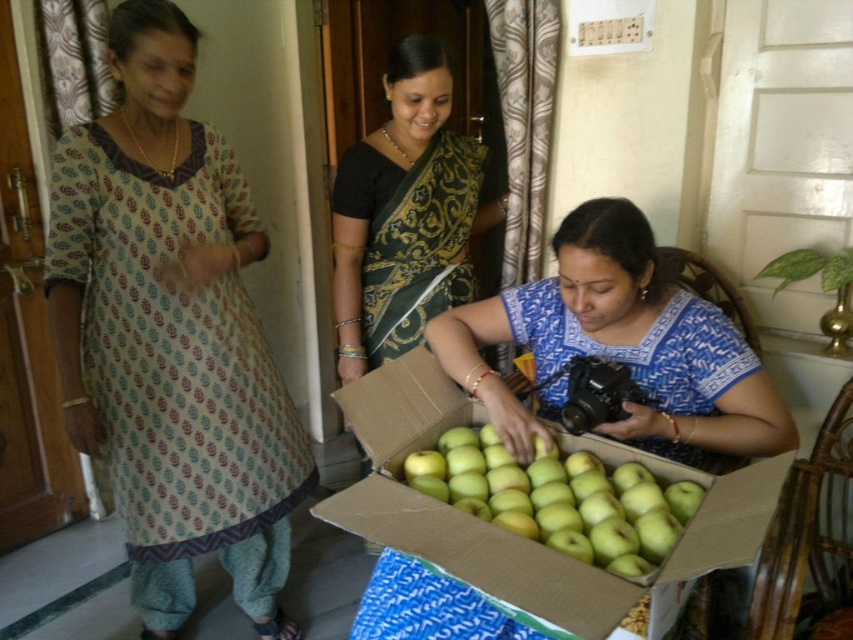
Question: Estimate the real-world distances between objects in this image. Which object is closer to the green matte apples at center?

Choices:
 (A) matte blue blouse at center
 (B) green matte cardboard box at lower center
 (C) green silk saree at center
 (D) printed cotton kurta at left

Answer: (B)

Question: Does printed cotton kurta at left have a greater width compared to green matte cardboard box at lower center?

Choices:
 (A) yes
 (B) no

Answer: (B)

Question: Which of these objects is positioned closest to the green silk saree at center?

Choices:
 (A) green matte apples at center
 (B) matte blue blouse at center
 (C) green matte cardboard box at lower center

Answer: (B)

Question: Is printed cotton kurta at left above green matte cardboard box at lower center?

Choices:
 (A) yes
 (B) no

Answer: (A)

Question: Which object is the closest to the green matte apples at center?

Choices:
 (A) matte blue blouse at center
 (B) printed cotton kurta at left

Answer: (A)

Question: Is matte blue blouse at center wider than green matte cardboard box at lower center?

Choices:
 (A) no
 (B) yes

Answer: (A)